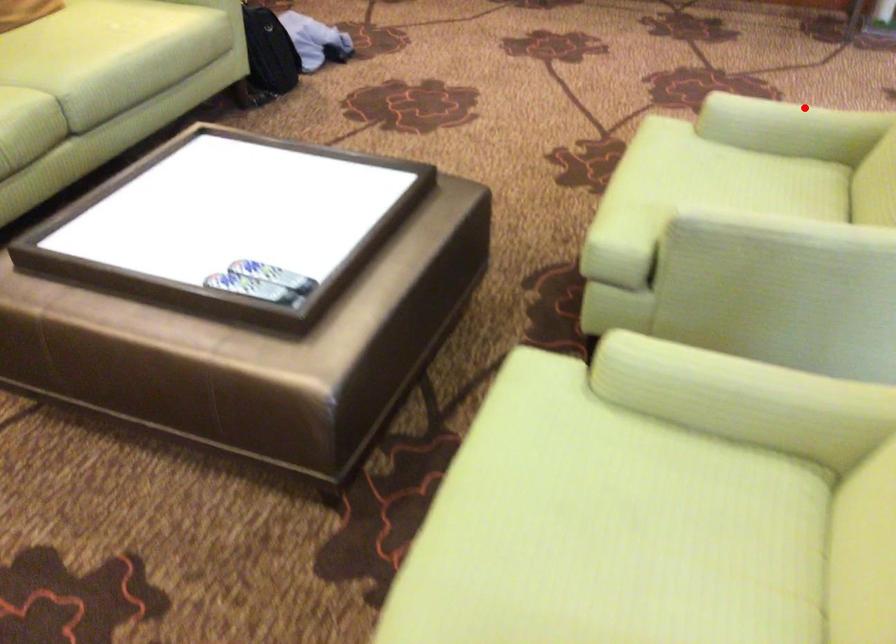
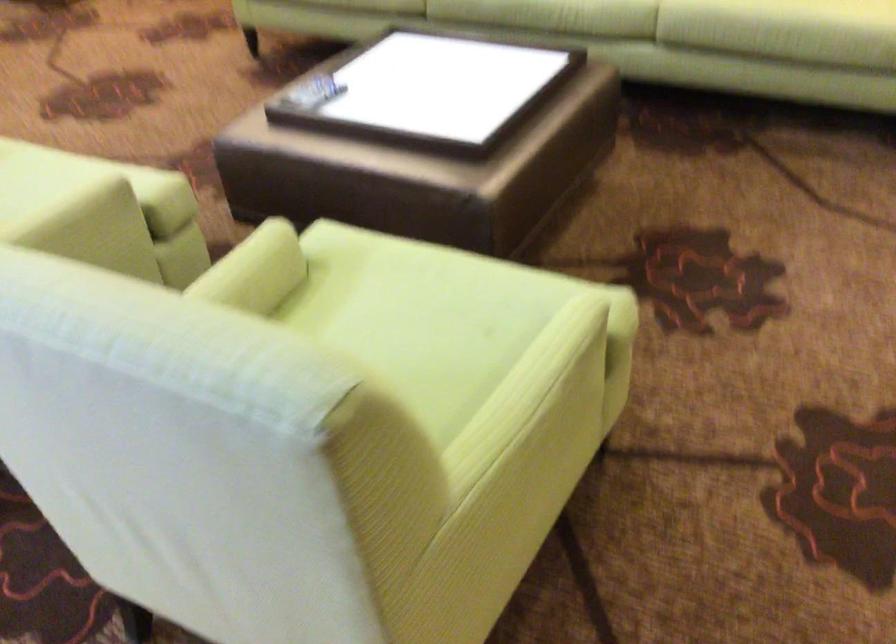
The point at the highlighted location is marked in the first image. Where is the corresponding point in the second image?

(528, 393)